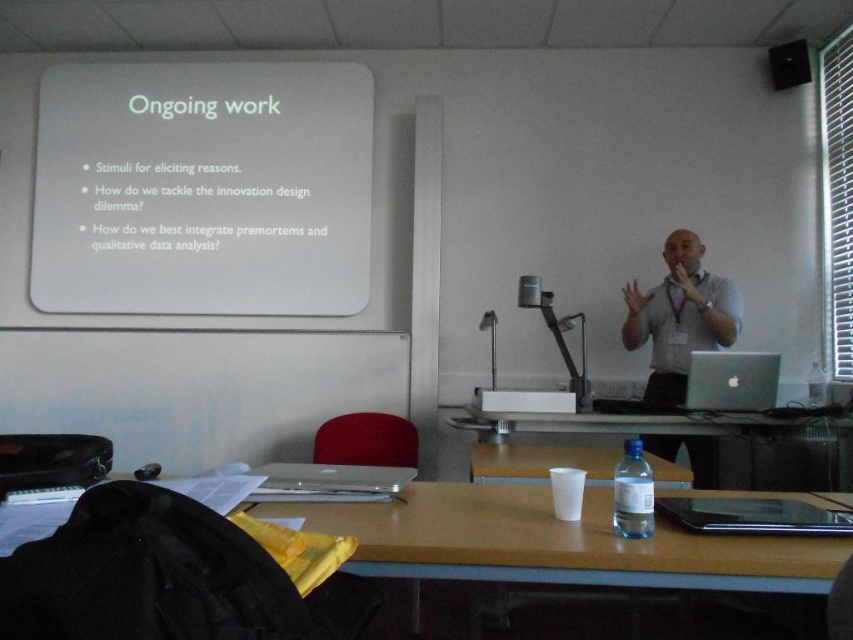
Question: Is clear plastic cup at center to the left of silver metallic laptop at center from the viewer's perspective?

Choices:
 (A) no
 (B) yes

Answer: (A)

Question: Which of the following is the farthest from the observer?

Choices:
 (A) white matte projection screen at upper left
 (B) silver metallic laptop at center

Answer: (A)

Question: Based on their relative distances, which object is nearer to the sleek silver laptop at center?

Choices:
 (A) wooden table at lower center
 (B) silver metallic laptop at right

Answer: (A)

Question: Which of the following is the closest to the observer?

Choices:
 (A) clear plastic cup at center
 (B) matte black speaker at upper right
 (C) white plastic projector at center

Answer: (A)

Question: Observing the image, what is the correct spatial positioning of silver metallic laptop at right in reference to white plastic projector at center?

Choices:
 (A) left
 (B) right

Answer: (B)

Question: Can you confirm if clear plastic cup at center is positioned below sleek silver laptop at center?

Choices:
 (A) no
 (B) yes

Answer: (B)